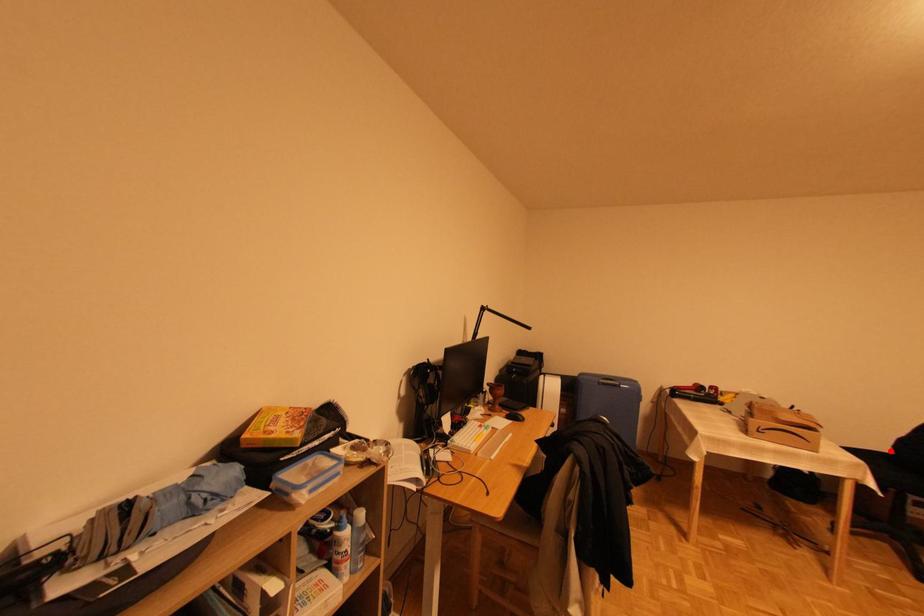
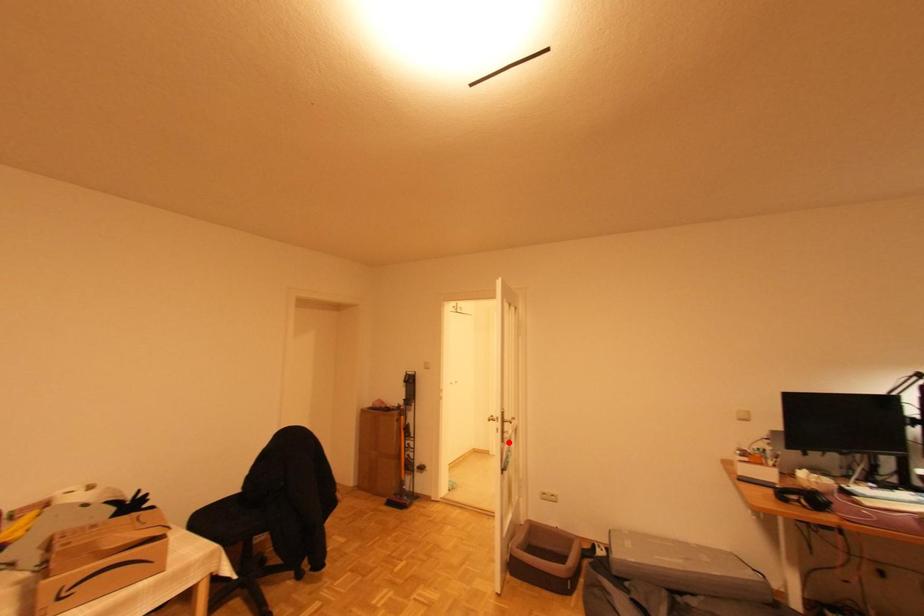
I am providing you with two images of the same scene from different viewpoints. A red point is marked on the first image and another point is marked on the second image. Are the points marked in image1 and image2 representing the same 3D position?

No